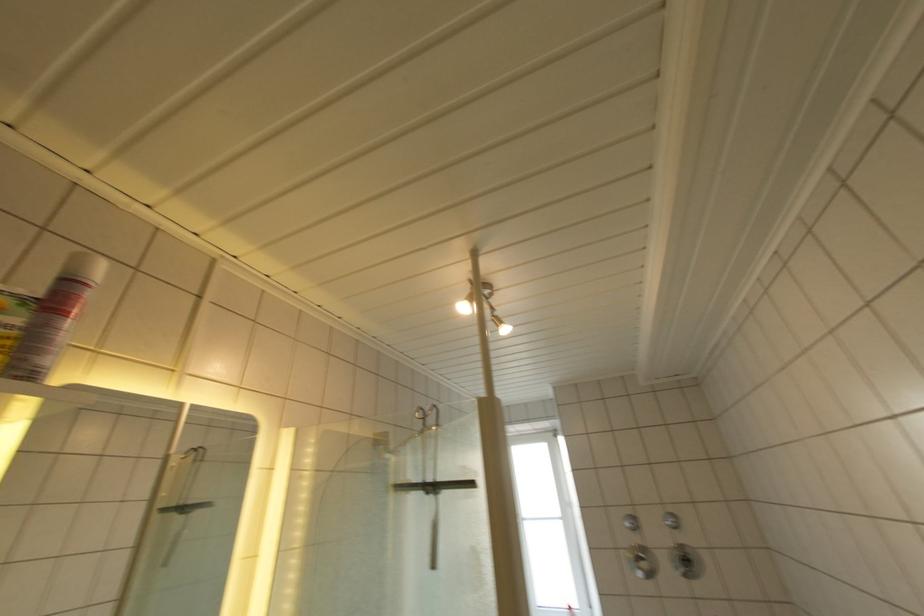
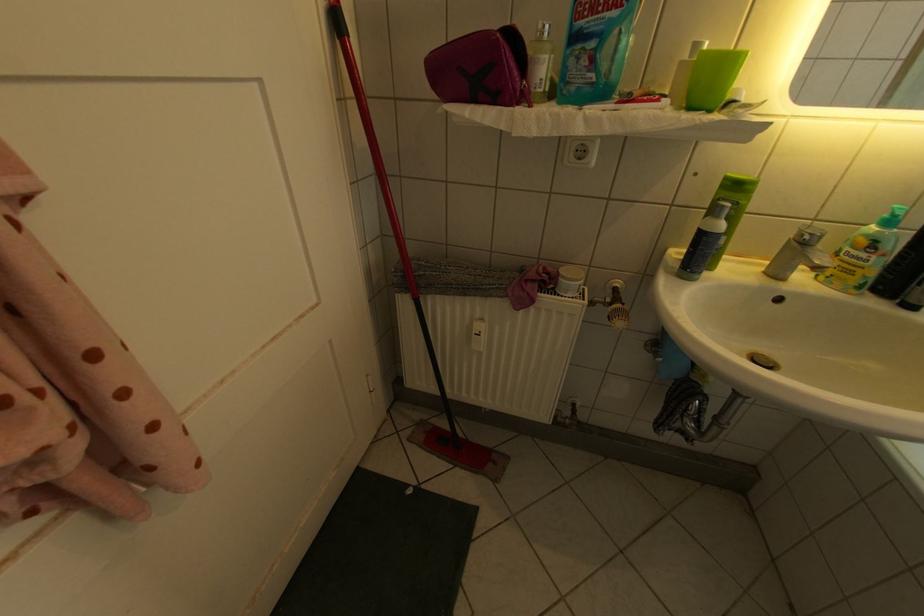
First-person continuous shooting, in which direction is the camera rotating?

The camera's rotation is toward left-down.